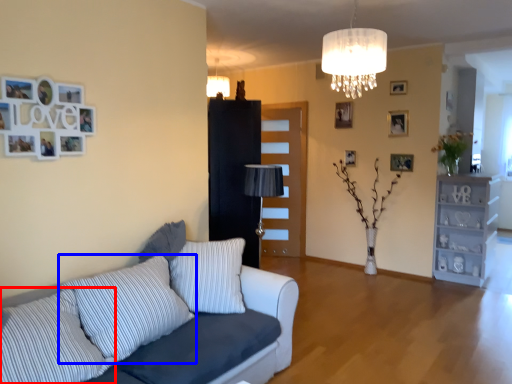
Question: Which object is further to the camera taking this photo, pillow (highlighted by a red box) or pillow (highlighted by a blue box)?

Choices:
 (A) pillow
 (B) pillow

Answer: (B)